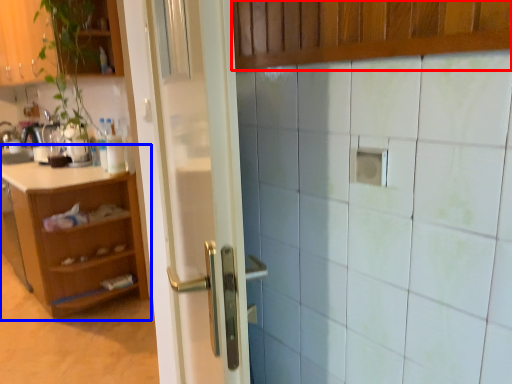
Question: Among these objects, which one is farthest to the camera, cabinetry (highlighted by a red box) or cabinetry (highlighted by a blue box)?

Choices:
 (A) cabinetry
 (B) cabinetry

Answer: (B)